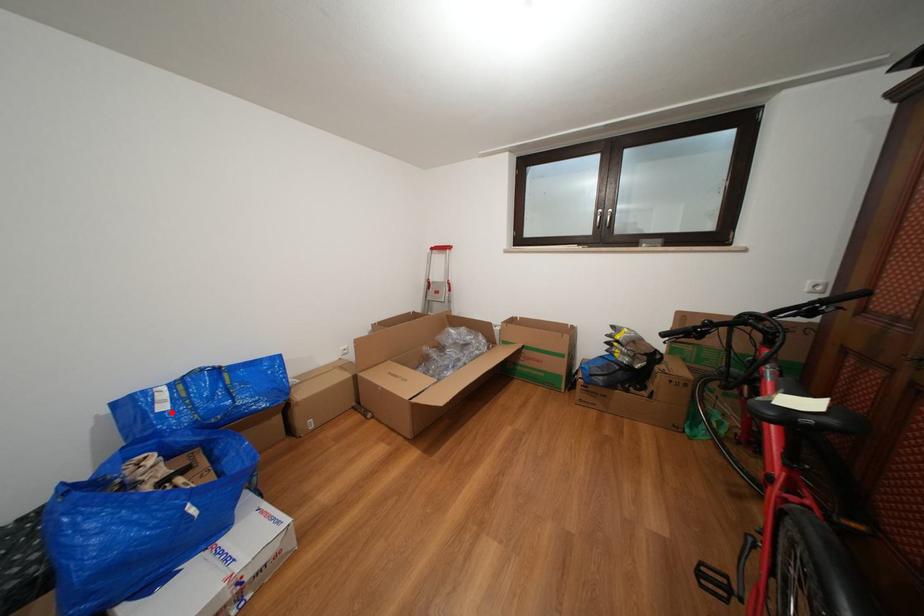
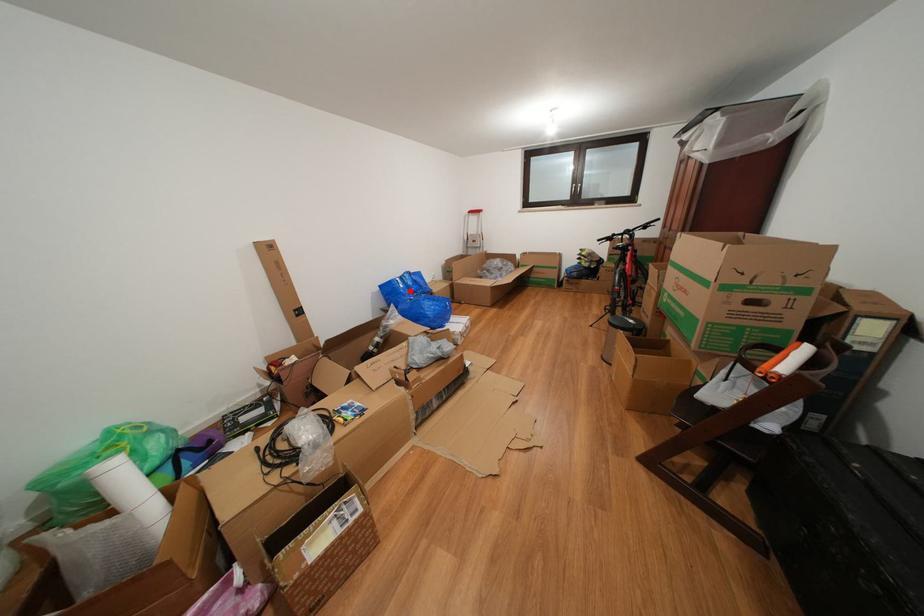
I am providing you with two images of the same scene from different viewpoints. A red point is marked on the first image and another point is marked on the second image. Does the point marked in image1 correspond to the same location as the one in image2?

Yes